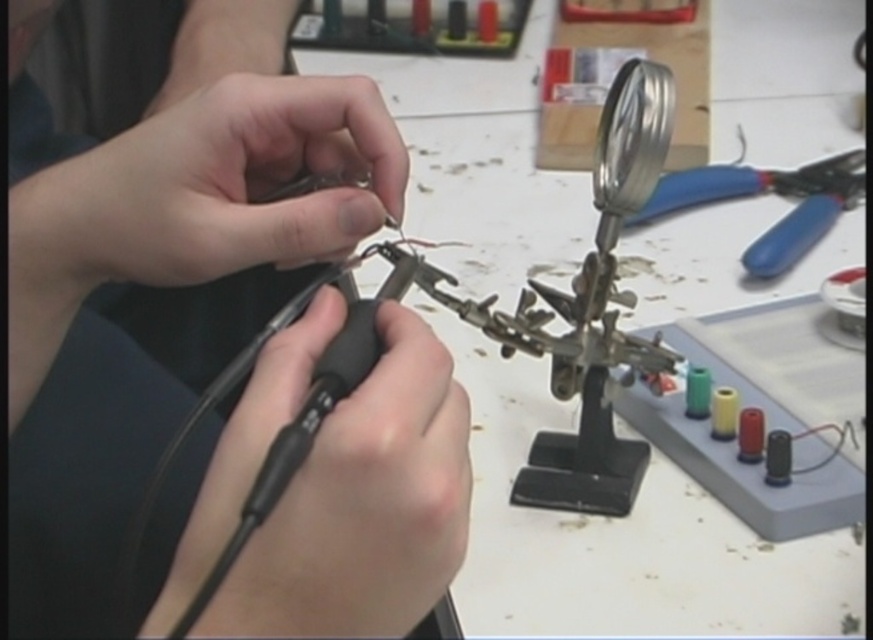
You are a novice solderer trying to reach for the matte black tool at center and the metallic silver magnifying glass at upper right. Which object is taller?

The matte black tool at center is taller than the metallic silver magnifying glass at upper right.

You are a beginner learning soldering and need to reach for the matte black tool at center and the blue plastic pliers at upper right. Which tool should you grab first if you want to pick up the one closer to you?

The matte black tool at center is closer to the viewer than the blue plastic pliers at upper right, so you should grab the matte black tool at center first.

You are trying to identify the tools on the workbench. According to the image, where is the black rubberized grip at center in relation to the matte black tool at center?

The black rubberized grip at center is located below the matte black tool at center.